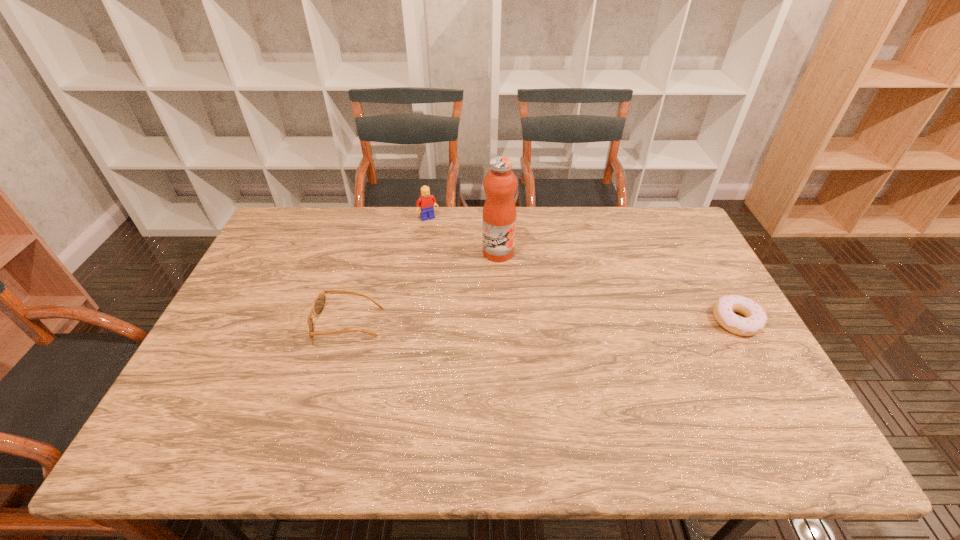
This screenshot has height=540, width=960. In order to click on free space on the desktop that is between the second shortest object and the rightmost object and is positioned on the front label of the third object from left to right in this screenshot , I will do `click(540, 322)`.

Locate an element on the screen. free space on the desktop that is between the third tallest object and the doughnut and is positioned on the face of the third shortest object is located at coordinates (495, 322).